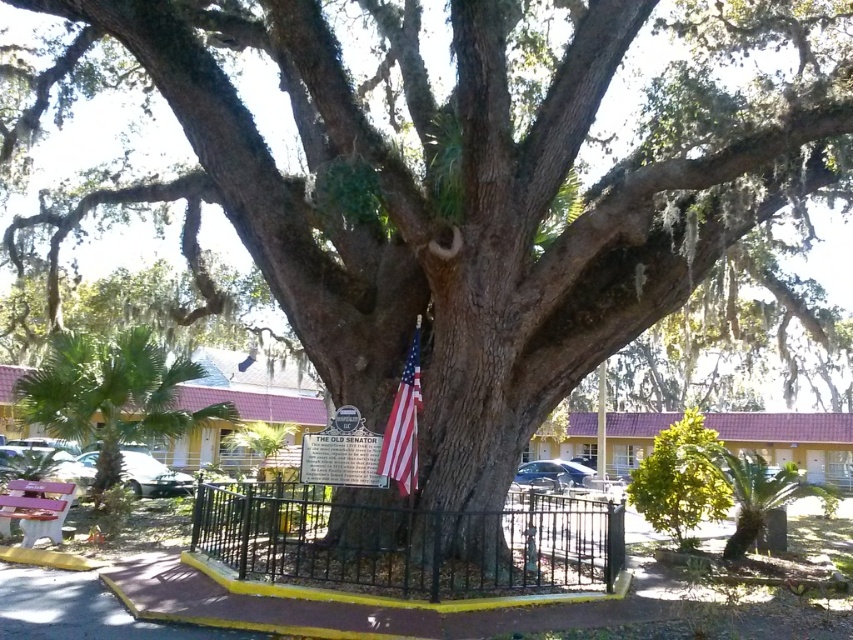
Between green leafy palm tree at lower left and matte pink wood bench at lower left, which one is positioned higher?

Positioned higher is green leafy palm tree at lower left.

Between green leafy palm tree at lower left and matte pink wood bench at lower left, which one has less height?

With less height is matte pink wood bench at lower left.

The height and width of the screenshot is (640, 853). I want to click on green leafy palm tree at lower left, so click(111, 394).

Locate an element on the screen. green leafy palm tree at lower left is located at coordinates (111, 394).

Identify the location of green leafy bush at center. The image size is (853, 640). (682, 480).

Can you confirm if green leafy bush at center is smaller than green leafy palm at lower right?

Yes, green leafy bush at center is smaller than green leafy palm at lower right.

Identify the location of green leafy bush at center. This screenshot has height=640, width=853. (682, 480).

The width and height of the screenshot is (853, 640). In order to click on green leafy bush at center in this screenshot , I will do 682,480.

Who is taller, black wrought iron fence at center or american flag at center?

Standing taller between the two is american flag at center.

Is black wrought iron fence at center wider than american flag at center?

Correct, the width of black wrought iron fence at center exceeds that of american flag at center.

The width and height of the screenshot is (853, 640). Describe the element at coordinates (405, 541) in the screenshot. I see `black wrought iron fence at center` at that location.

The width and height of the screenshot is (853, 640). I want to click on black wrought iron fence at center, so click(405, 541).